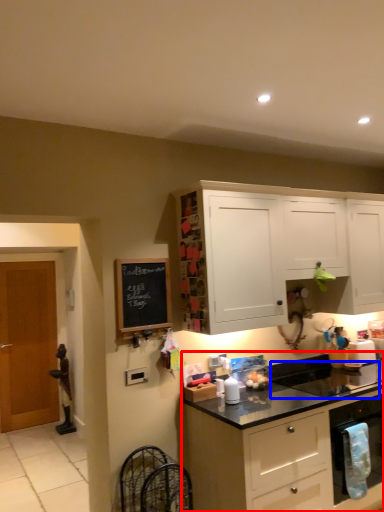
Question: Which object is further to the camera taking this photo, cabinetry (highlighted by a red box) or sink (highlighted by a blue box)?

Choices:
 (A) cabinetry
 (B) sink

Answer: (B)